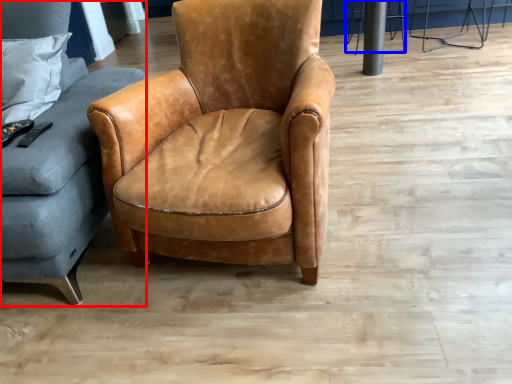
Question: Among these objects, which one is nearest to the camera, studio couch (highlighted by a red box) or bar stool (highlighted by a blue box)?

Choices:
 (A) studio couch
 (B) bar stool

Answer: (A)